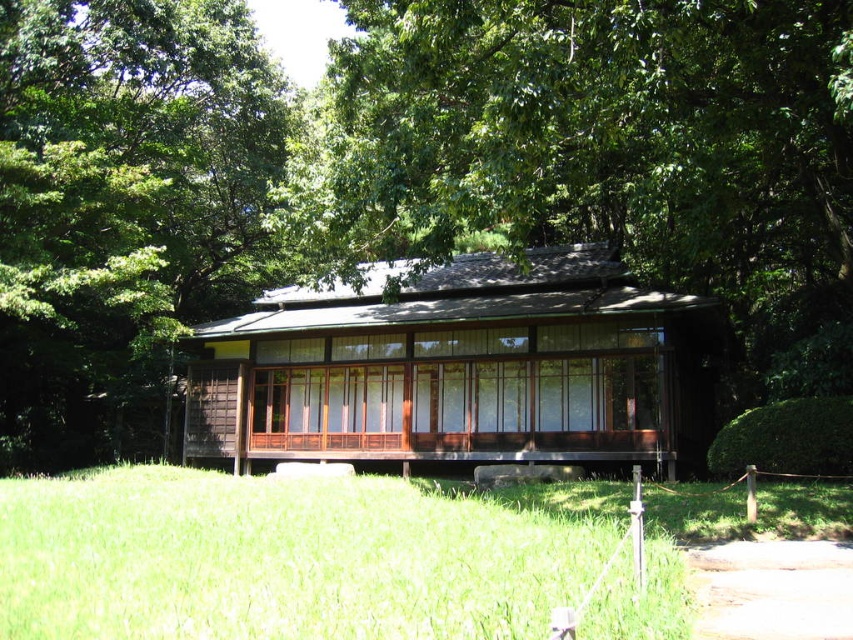
Question: Is the position of green grass at center less distant than that of brown wooden cabin at center?

Choices:
 (A) yes
 (B) no

Answer: (A)

Question: Does green leafy tree at center appear over green grass at center?

Choices:
 (A) yes
 (B) no

Answer: (A)

Question: Among these objects, which one is nearest to the camera?

Choices:
 (A) green leafy tree at center
 (B) green grass at center

Answer: (B)

Question: Among these objects, which one is farthest from the camera?

Choices:
 (A) brown wooden cabin at center
 (B) green grass at center

Answer: (A)

Question: Is green grass at center wider than brown wooden cabin at center?

Choices:
 (A) no
 (B) yes

Answer: (A)

Question: Estimate the real-world distances between objects in this image. Which object is farther from the green grass at center?

Choices:
 (A) brown wooden cabin at center
 (B) green leafy tree at center

Answer: (B)